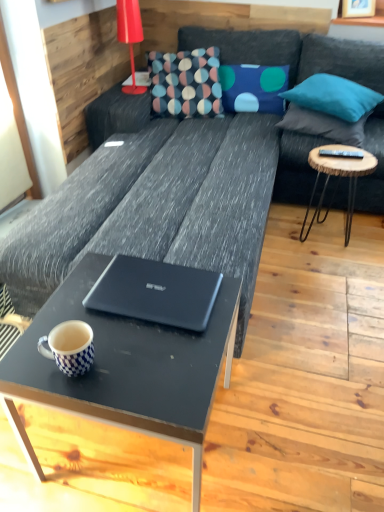
The width and height of the screenshot is (384, 512). I want to click on vacant area to the left of matte black laptop at center, so click(71, 303).